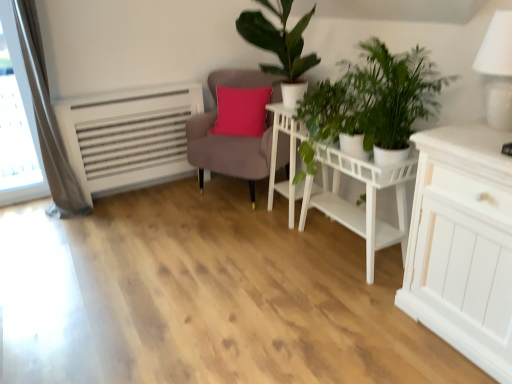
Question: Considering the relative sizes of white matte table at center and white matte side table at center in the image provided, is white matte table at center smaller than white matte side table at center?

Choices:
 (A) no
 (B) yes

Answer: (A)

Question: Does white matte table at center have a lesser width compared to white matte side table at center?

Choices:
 (A) no
 (B) yes

Answer: (A)

Question: Is white matte table at center aimed at white matte side table at center?

Choices:
 (A) yes
 (B) no

Answer: (B)

Question: Is white matte table at center wider than white matte side table at center?

Choices:
 (A) no
 (B) yes

Answer: (B)

Question: Is white matte table at center at the left side of white matte side table at center?

Choices:
 (A) yes
 (B) no

Answer: (B)

Question: From a real-world perspective, is green leafy plant at center positioned above or below matte brown armchair at center?

Choices:
 (A) below
 (B) above

Answer: (B)

Question: In the image, is green leafy plant at center positioned in front of or behind matte brown armchair at center?

Choices:
 (A) behind
 (B) front

Answer: (B)

Question: From the image's perspective, is green leafy plant at center above or below matte brown armchair at center?

Choices:
 (A) below
 (B) above

Answer: (A)

Question: Considering the positions of green leafy plant at center and matte brown armchair at center in the image, is green leafy plant at center taller or shorter than matte brown armchair at center?

Choices:
 (A) tall
 (B) short

Answer: (B)

Question: Is green leafy plant at center wider or thinner than white matte table at center?

Choices:
 (A) wide
 (B) thin

Answer: (A)

Question: Choose the correct answer: Is green leafy plant at center inside white matte table at center or outside it?

Choices:
 (A) outside
 (B) inside

Answer: (A)

Question: Relative to white matte table at center, is green leafy plant at center in front or behind?

Choices:
 (A) front
 (B) behind

Answer: (B)

Question: From a real-world perspective, is green leafy plant at center positioned above or below white matte table at center?

Choices:
 (A) below
 (B) above

Answer: (B)

Question: In terms of size, does white matte side table at center appear bigger or smaller than green matte plant at upper center, positioned as the second houseplant in front-to-back order?

Choices:
 (A) small
 (B) big

Answer: (A)

Question: From their relative heights in the image, would you say white matte side table at center is taller or shorter than green matte plant at upper center, positioned as the second houseplant in front-to-back order?

Choices:
 (A) tall
 (B) short

Answer: (A)